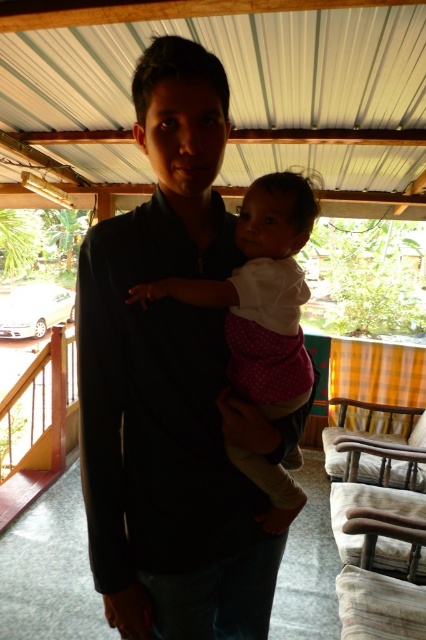
You are a photographer trying to capture a closeup of the white polka dot fabric at center without including the dark blue shirt at center in the frame. Given their sizes, is this possible?

The dark blue shirt at center is wider than the white polka dot fabric at center. Therefore, it might be challenging to capture the white polka dot fabric at center without including the dark blue shirt at center in the frame since the shirt is wider.

You are a photographer trying to capture the man and baby in the scene. You want to ensure the dark blue shirt at center and white polka dot fabric at center are both visible in the frame. Based on their positions, which object should you focus on first to ensure both are in the shot?

The dark blue shirt at center is positioned on the left side of white polka dot fabric at center, so focusing on the dark blue shirt at center first will help ensure both objects are included in the frame since the white polka dot fabric at center is to the right of it.

You are taking a photo of the scene and want to focus on both the man and the baby. The camera can only focus on objects at one depth. Which point should you choose to ensure both are in focus? The points are located at point [161,220] and point [279,484].

You should choose point [279,484] because it is farther from the camera, so the depth of field will include both the closer and farther objects.